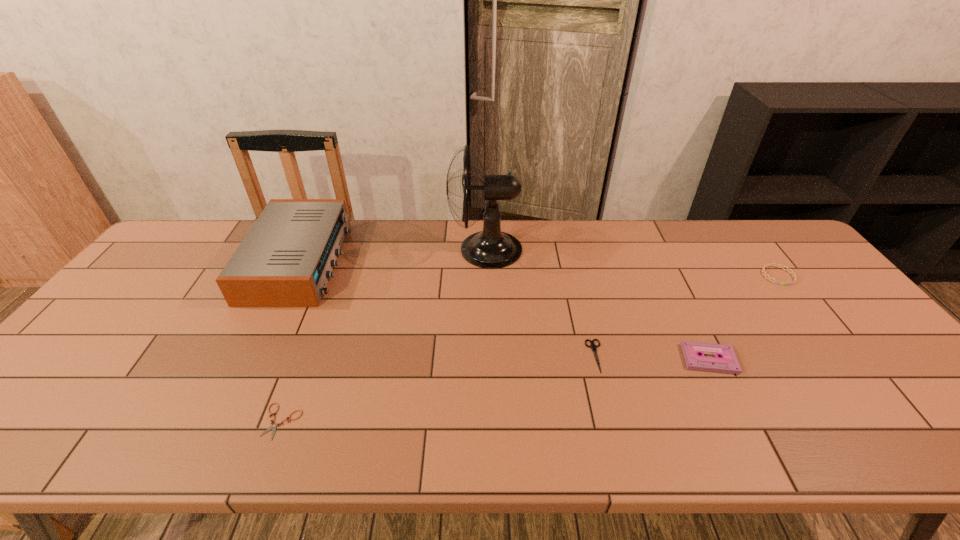
Where is `object situated at the right edge`? The image size is (960, 540). object situated at the right edge is located at coordinates (782, 267).

In order to click on free location at the far edge of the desktop in this screenshot , I will do `click(246, 221)`.

Locate an element on the screen. free space at the near edge is located at coordinates (763, 417).

In the image, there is a desktop. Identify the location of vacant space at the left edge. (24, 414).

Identify the location of free space at the right edge. This screenshot has height=540, width=960. coord(841,376).

In order to click on vacant space at the far left corner of the desktop in this screenshot , I will do `click(187, 259)`.

Where is `free space at the near right corner of the desktop`? free space at the near right corner of the desktop is located at coordinates (897, 447).

Find the location of a particular element. vacant area that lies between the farther shears and the fifth object from left to right is located at coordinates (653, 357).

Where is `empty location between the videotape and the bracelet`? The height and width of the screenshot is (540, 960). empty location between the videotape and the bracelet is located at coordinates (744, 317).

The image size is (960, 540). I want to click on vacant space that's between the radio receiver and the fan, so click(393, 255).